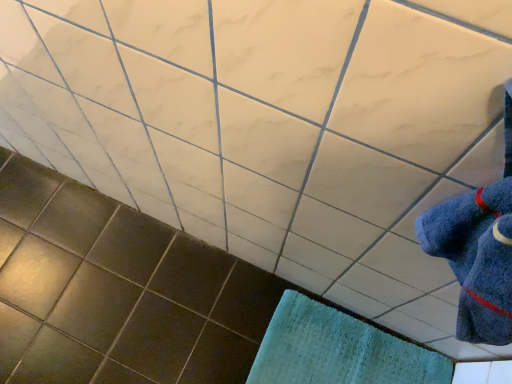
Locate an element on the screen. This screenshot has width=512, height=384. teal soft bath mat at lower right is located at coordinates (338, 350).

The width and height of the screenshot is (512, 384). What do you see at coordinates (338, 350) in the screenshot? I see `teal soft bath mat at lower right` at bounding box center [338, 350].

Identify the location of teal soft bath mat at lower right. (338, 350).